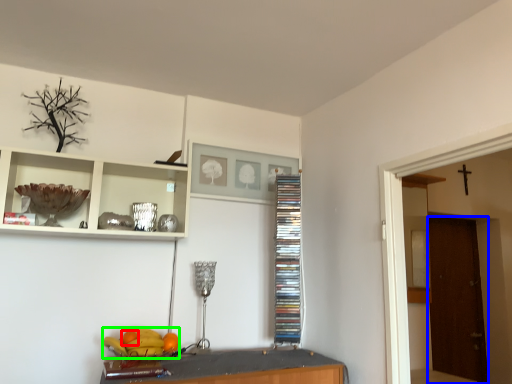
Question: Considering the real-world distances, which object is farthest from orange (highlighted by a red box)? door (highlighted by a blue box) or fruit (highlighted by a green box)?

Choices:
 (A) door
 (B) fruit

Answer: (A)